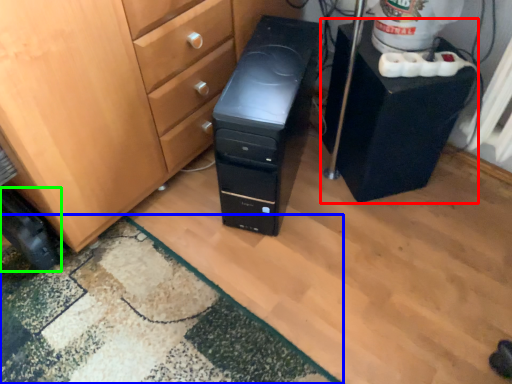
Question: Based on their relative distances, which object is farther from furniture (highlighted by a red box)? Choose from doormat (highlighted by a blue box) and wheel (highlighted by a green box).

Choices:
 (A) doormat
 (B) wheel

Answer: (B)